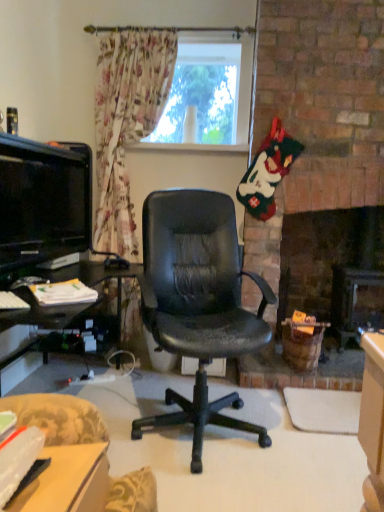
Question: Does point (61, 244) appear closer or farther from the camera than point (51, 476)?

Choices:
 (A) closer
 (B) farther

Answer: (B)

Question: From a real-world perspective, is matte black tv at left positioned above or below matte plastic desk at lower left?

Choices:
 (A) below
 (B) above

Answer: (B)

Question: Which of these objects is positioned farthest from the matte black tv at left?

Choices:
 (A) matte plastic desk at lower left
 (B) transparent glass window at upper center

Answer: (A)

Question: Which of these objects is positioned closest to the transparent glass window at upper center?

Choices:
 (A) matte plastic desk at lower left
 (B) matte black tv at left

Answer: (B)